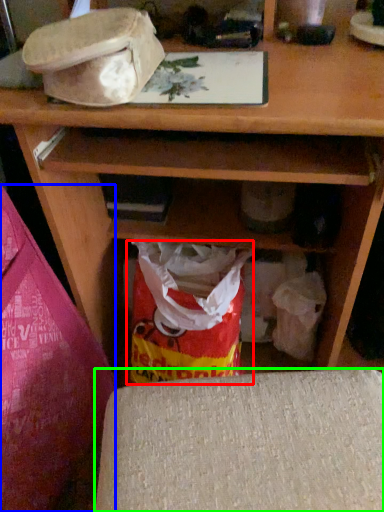
Question: Based on their relative distances, which object is nearer to grocery bag (highlighted by a red box)? Choose from leftover (highlighted by a blue box) and furniture (highlighted by a green box).

Choices:
 (A) leftover
 (B) furniture

Answer: (A)